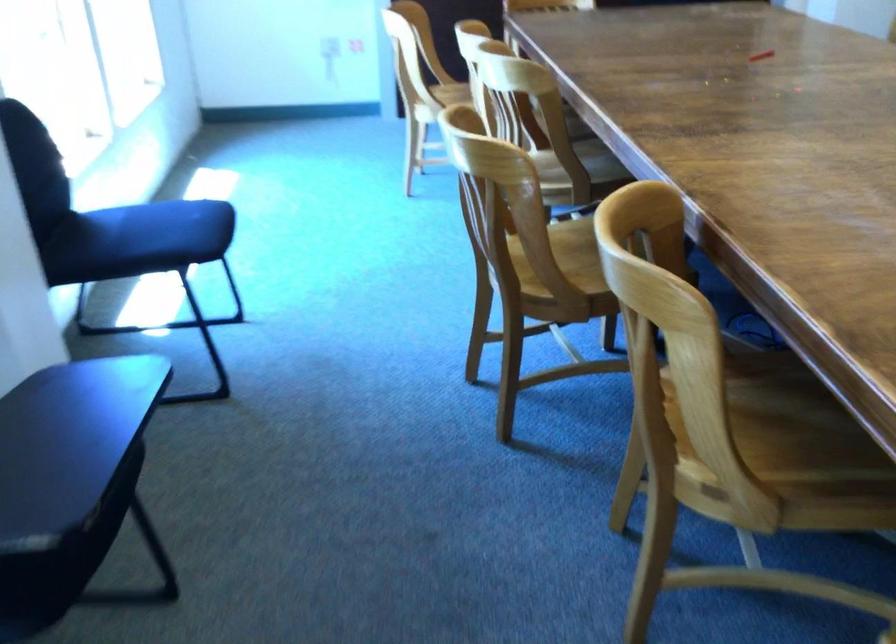
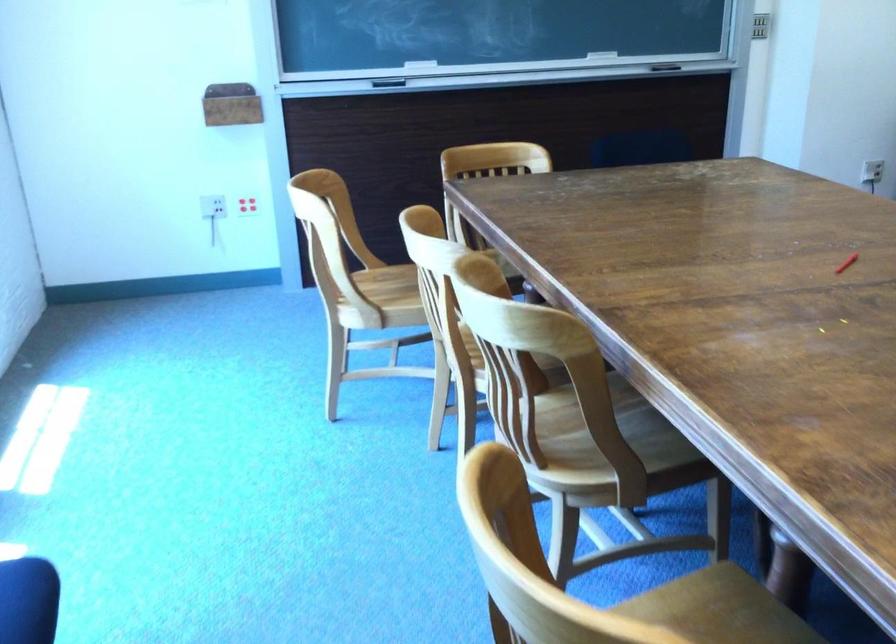
Where in the second image is the point corresponding to the point at 558,138 from the first image?

(606, 422)